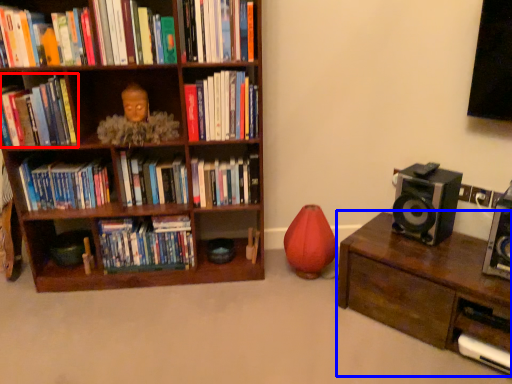
Question: Which point is further to the camera, book (highlighted by a red box) or table (highlighted by a blue box)?

Choices:
 (A) book
 (B) table

Answer: (A)